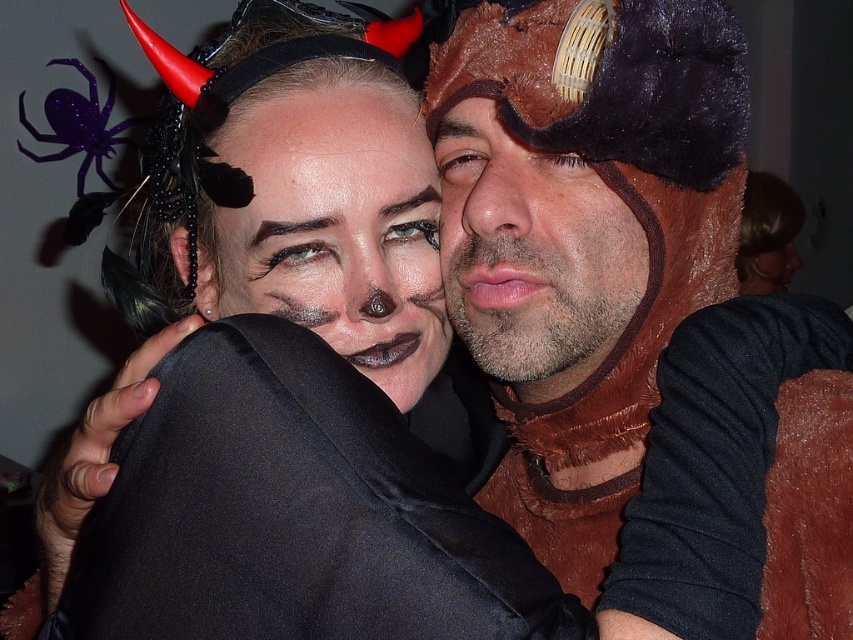
Question: Which object appears closest to the camera in this image?

Choices:
 (A) brown furry hat at center
 (B) black satin jacket at center
 (C) purple glittery spider at upper left
 (D) matte black face at center

Answer: (B)

Question: Can you confirm if black satin jacket at center is positioned below brown furry hat at center?

Choices:
 (A) yes
 (B) no

Answer: (A)

Question: Which of the following is the farthest from the observer?

Choices:
 (A) (503, 611)
 (B) (268, 308)
 (C) (566, 184)

Answer: (B)

Question: Which object is the closest to the purple glittery spider at upper left?

Choices:
 (A) matte black face at center
 (B) black satin jacket at center
 (C) brown furry hat at center

Answer: (A)

Question: Can you confirm if brown furry hat at center is bigger than purple glittery spider at upper left?

Choices:
 (A) yes
 (B) no

Answer: (B)

Question: Can you confirm if black satin jacket at center is smaller than matte black face at center?

Choices:
 (A) yes
 (B) no

Answer: (A)